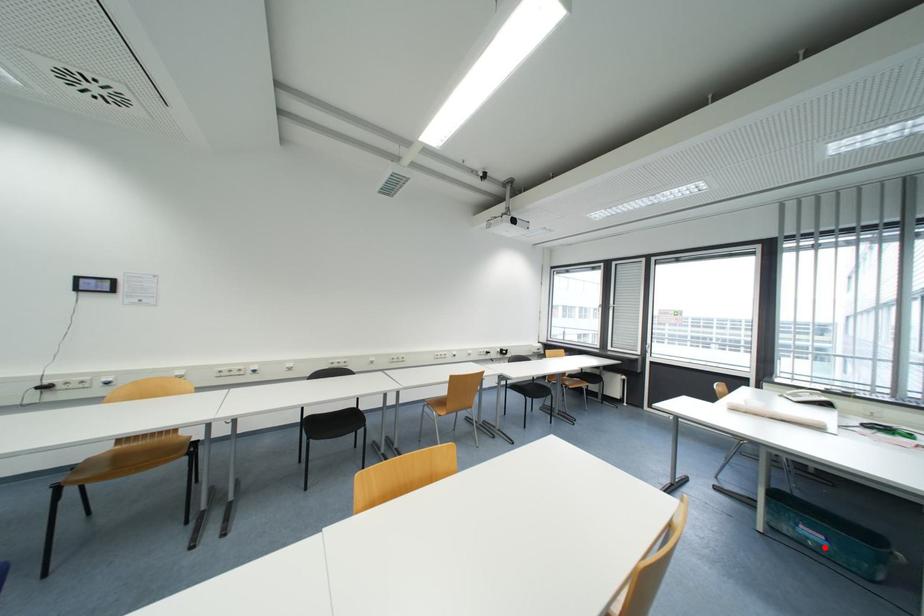
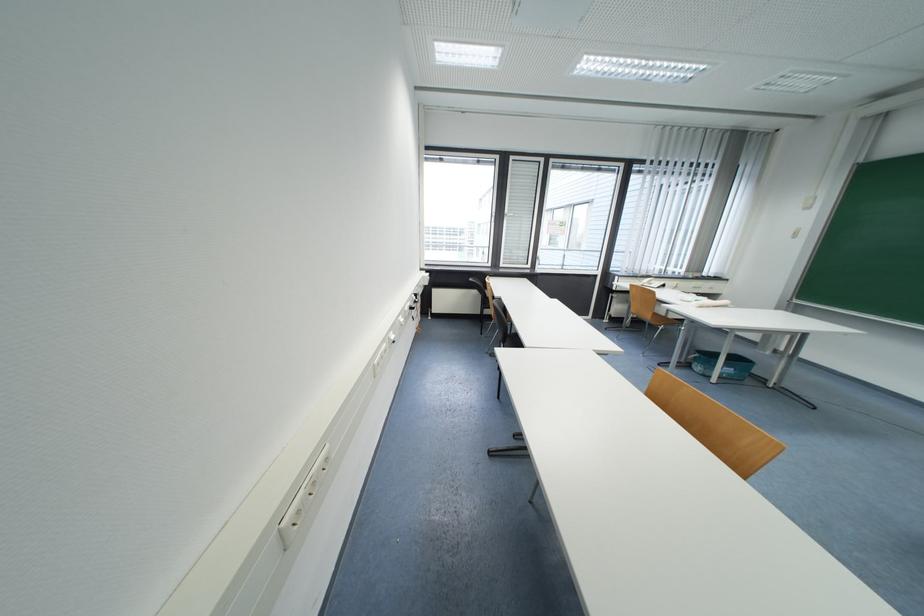
Question: I am providing you with two images of the same scene from different viewpoints. In image1, a red point is highlighted. Considering the same 3D point in image2, which of the following is correct?

Choices:
 (A) It is closer
 (B) It is farther

Answer: (B)